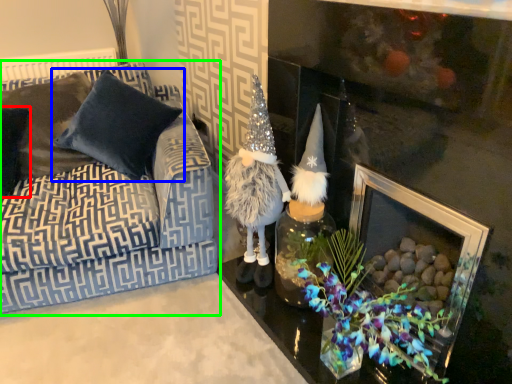
Question: Based on their relative distances, which object is nearer to pillow (highlighted by a red box)? Choose from pillow (highlighted by a blue box) and studio couch (highlighted by a green box).

Choices:
 (A) pillow
 (B) studio couch

Answer: (A)